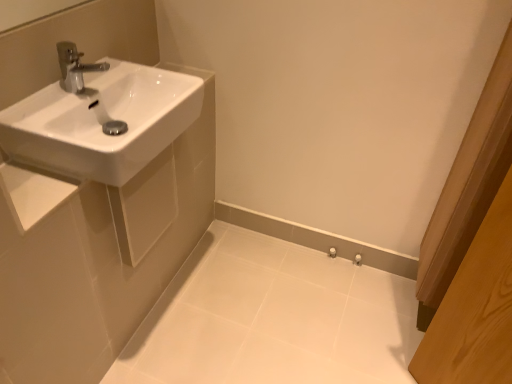
Question: Based on their positions, is white glossy sink at upper left located to the left or right of white glossy porcelain at lower center?

Choices:
 (A) right
 (B) left

Answer: (B)

Question: Considering the positions of point (104, 94) and point (300, 337), is point (104, 94) closer or farther from the camera than point (300, 337)?

Choices:
 (A) closer
 (B) farther

Answer: (A)

Question: Which object is positioned closest to the white glossy porcelain at lower center?

Choices:
 (A) white glossy sink at upper left
 (B) white glossy sink at left

Answer: (B)

Question: Estimate the real-world distances between objects in this image. Which object is farther from the white glossy sink at left?

Choices:
 (A) white glossy sink at upper left
 (B) white glossy porcelain at lower center

Answer: (B)